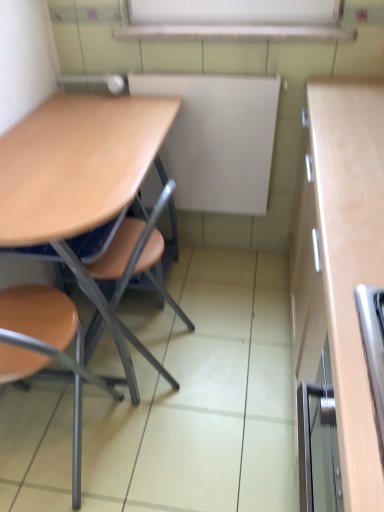
This screenshot has width=384, height=512. What do you see at coordinates (218, 139) in the screenshot? I see `white matte board at center` at bounding box center [218, 139].

What do you see at coordinates (81, 182) in the screenshot?
I see `matte wood desk at left` at bounding box center [81, 182].

This screenshot has height=512, width=384. Describe the element at coordinates (45, 349) in the screenshot. I see `brown matte chair at left` at that location.

Where is `brown matte chair at left`? Image resolution: width=384 pixels, height=512 pixels. brown matte chair at left is located at coordinates (45, 349).

The height and width of the screenshot is (512, 384). I want to click on white matte board at center, so click(218, 139).

From a real-world perspective, who is located lower, white matte board at center or matte wood desk at left?

From a 3D spatial view, matte wood desk at left is below.

Considering the sizes of objects white matte board at center and matte wood desk at left in the image provided, who is wider, white matte board at center or matte wood desk at left?

matte wood desk at left.

In the scene shown: Which is less distant, (242, 140) or (24, 186)?

The point (24, 186) is closer to the camera.

Is white matte board at center aimed at matte wood desk at left?

Yes, white matte board at center faces towards matte wood desk at left.

How far apart are matte wood desk at left and brown matte chair at left?

A distance of 35.34 centimeters exists between matte wood desk at left and brown matte chair at left.

Is matte wood desk at left directly adjacent to brown matte chair at left?

matte wood desk at left is not next to brown matte chair at left, and they're not touching.

Considering the relative positions of matte wood desk at left and brown matte chair at left in the image provided, is matte wood desk at left in front of brown matte chair at left?

No, it is not.

Which is closer to the camera, (26, 122) or (11, 371)?

Point (11, 371)

Which is correct: brown matte chair at left is inside white matte board at center, or outside of it?

brown matte chair at left is not enclosed by white matte board at center.

Based on the photo, how much distance is there between brown matte chair at left and white matte board at center?

Result: brown matte chair at left and white matte board at center are 38.00 inches apart.

Between point (53, 346) and point (183, 164), which one is positioned in front?

Positioned in front is point (53, 346).

Considering the relative sizes of brown matte chair at left and white matte board at center in the image provided, is brown matte chair at left bigger than white matte board at center?

Yes.

Is white matte board at center facing towards brown matte chair at left?

Yes, white matte board at center faces towards brown matte chair at left.

Which object is closer to the camera, white matte board at center or brown matte chair at left?

brown matte chair at left is in front.

From a real-world perspective, does white matte board at center stand above brown matte chair at left?

Yes, from a real-world perspective, white matte board at center is above brown matte chair at left.

How different are the orientations of brown matte chair at left and matte wood desk at left in degrees?

They differ by 91 degrees in their facing directions.

From their relative heights in the image, would you say brown matte chair at left is taller or shorter than matte wood desk at left?

Considering their sizes, brown matte chair at left has less height than matte wood desk at left.

Consider the image. Which object is further away from the camera taking this photo, brown matte chair at left or matte wood desk at left?

Positioned behind is matte wood desk at left.

Which is behind, point (139, 348) or point (208, 143)?

The point (208, 143) is farther.

Is matte wood desk at left with white matte board at center?

No, matte wood desk at left is not making contact with white matte board at center.

Is matte wood desk at left to the left of white matte board at center from the viewer's perspective?

Correct, you'll find matte wood desk at left to the left of white matte board at center.

Identify the location of desk to the left of white matte board at center. (81, 182).

Locate an element on the screen. chair below the matte wood desk at left (from the image's perspective) is located at coordinates (45, 349).

Estimate the real-world distances between objects in this image. Which object is closer to brown matte chair at left, matte wood desk at left or white matte board at center?

Among the two, matte wood desk at left is located nearer to brown matte chair at left.

Based on the photo, estimate the real-world distances between objects in this image. Which object is further from matte wood desk at left, white matte board at center or brown matte chair at left?

Among the two, white matte board at center is located further to matte wood desk at left.

Considering their positions, is matte wood desk at left positioned further to white matte board at center than brown matte chair at left?

brown matte chair at left.

From the image, which object appears to be farther from matte wood desk at left, brown matte chair at left or white matte board at center?

white matte board at center lies further to matte wood desk at left than the other object.

Based on their spatial positions, is white matte board at center or matte wood desk at left further from brown matte chair at left?

white matte board at center.

In the scene shown: From the image, which object appears to be farther from white matte board at center, brown matte chair at left or matte wood desk at left?

Based on the image, brown matte chair at left appears to be further to white matte board at center.

Find the location of a particular element. The width and height of the screenshot is (384, 512). desk between brown matte chair at left and white matte board at center along the z-axis is located at coordinates (81, 182).